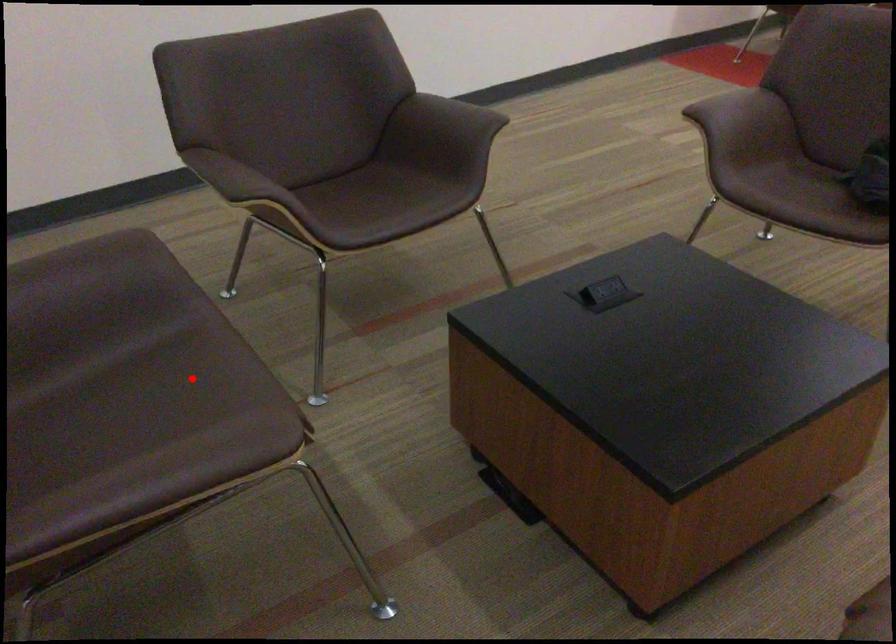
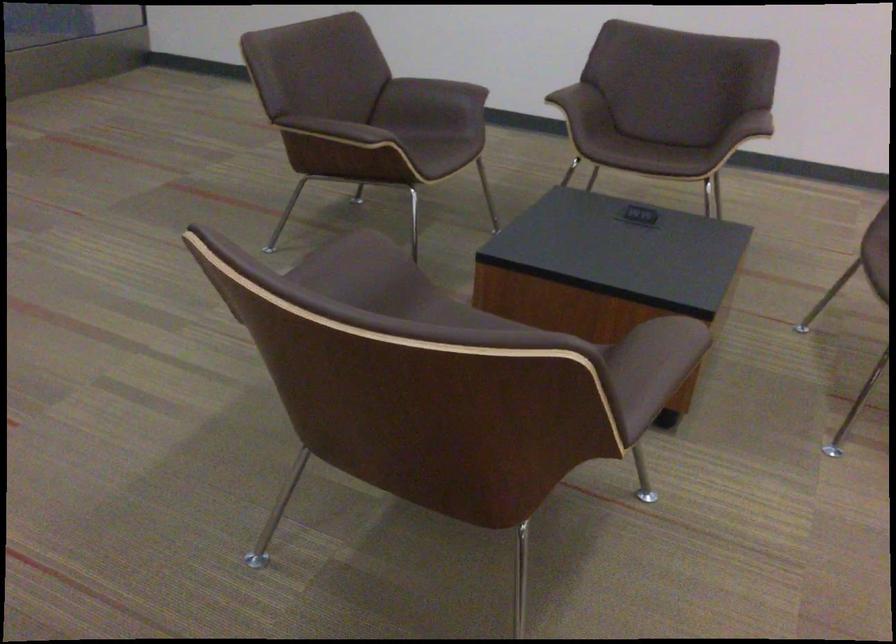
Question: I am providing you with two images of the same scene from different viewpoints. In image1, a red point is highlighted. Considering the same 3D point in image2, which of the following is correct?

Choices:
 (A) It is closer
 (B) It is farther

Answer: (B)